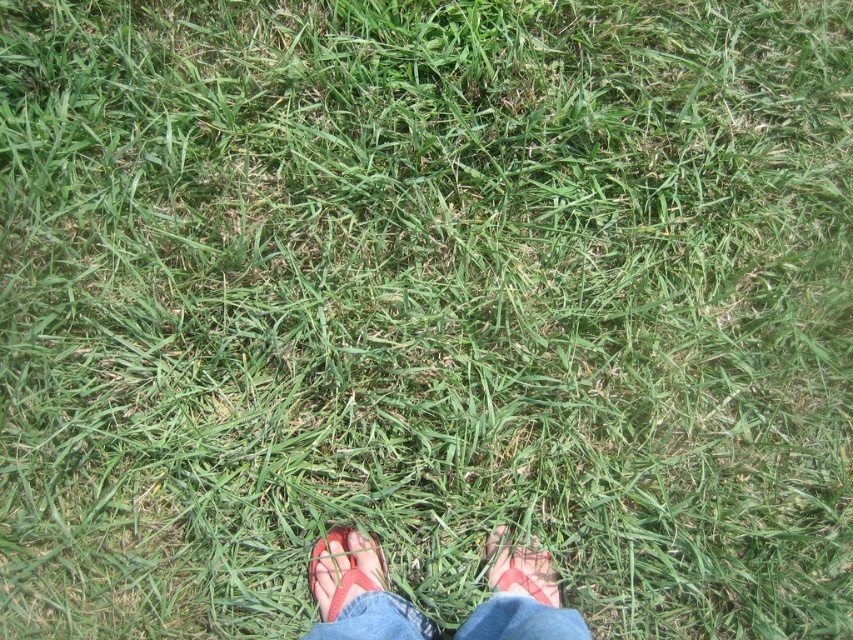
Which is in front, point (517, 632) or point (335, 579)?

Point (517, 632) is in front.

Can you confirm if rubber flip-flops at lower center is bigger than rubber sandal at lower center?

Yes, rubber flip-flops at lower center is bigger than rubber sandal at lower center.

Where is `rubber flip-flops at lower center`? rubber flip-flops at lower center is located at coordinates 358,593.

Is rubber flip-flops at lower center to the right of blue denim jeans at lower center from the viewer's perspective?

Correct, you'll find rubber flip-flops at lower center to the right of blue denim jeans at lower center.

Can you confirm if rubber flip-flops at lower center is wider than blue denim jeans at lower center?

In fact, rubber flip-flops at lower center might be narrower than blue denim jeans at lower center.

Is point (344, 572) in front of point (425, 621)?

No, (344, 572) is further to viewer.

Find the location of a particular element. Image resolution: width=853 pixels, height=640 pixels. rubber flip-flops at lower center is located at coordinates (358, 593).

Which is above, blue denim jeans at lower center or rubber sandal at lower center?

rubber sandal at lower center

From the picture: Is blue denim jeans at lower center thinner than rubber sandal at lower center?

In fact, blue denim jeans at lower center might be wider than rubber sandal at lower center.

Between point (583, 632) and point (325, 554), which one is positioned in front?

Point (583, 632) is more forward.

Identify the location of blue denim jeans at lower center. The image size is (853, 640). (521, 620).